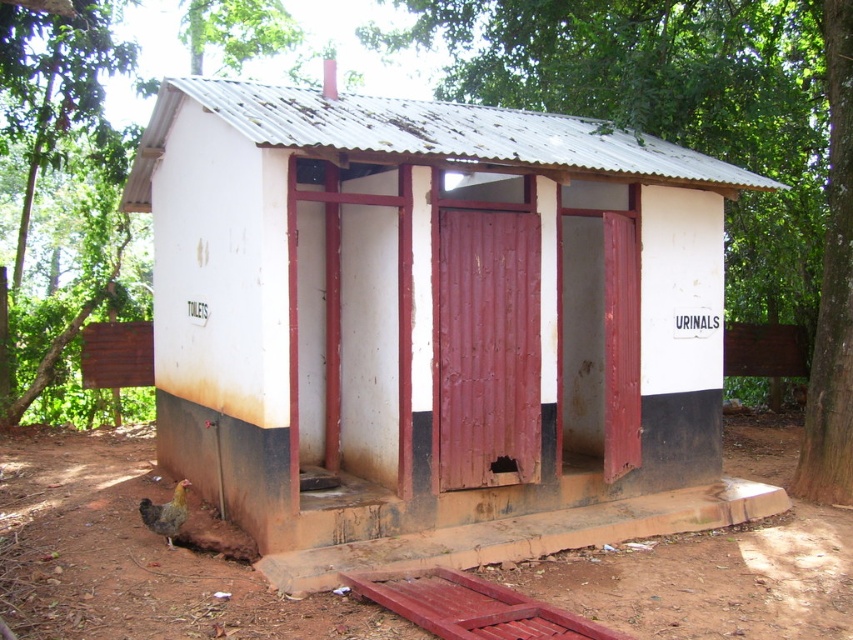
You are standing in front of the public restroom and notice a green leafy tree at center and a brown feathered chicken at lower left. Which object is closer to you?

The brown feathered chicken at lower left is closer to you since the green leafy tree at center is further away.

You are standing in front of the public restroom and want to take a photo of the green leafy tree at center. Your camera has a maximum focus range of 7 meters. Will you be able to focus on the tree without moving closer?

The green leafy tree at center is 7.79 meters away from the camera. Since the camera can only focus up to 7 meters, you will not be able to focus on the tree without moving closer.